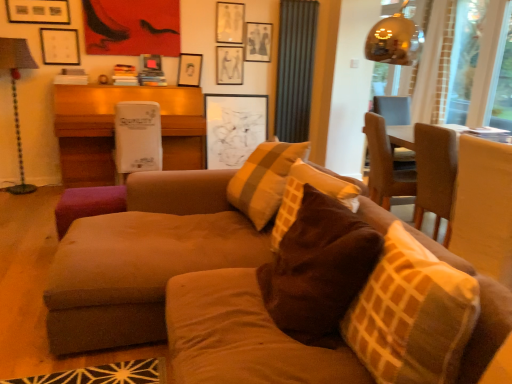
Question: Based on their positions, is suede couch at center located to the left or right of matte black picture frame at upper center, the fourth picture frame from the left?

Choices:
 (A) left
 (B) right

Answer: (B)

Question: From the image's perspective, relative to matte black picture frame at upper center, the fourth picture frame from the left, is suede couch at center above or below?

Choices:
 (A) below
 (B) above

Answer: (A)

Question: Which object is the farthest from the matte black picture frame at upper center, which is the fifth picture frame in left-to-right order?

Choices:
 (A) suede couch at center
 (B) wooden table at right, the 2th table viewed from the back
 (C) transparent glass window screen at upper right, arranged as the 1th window screen when viewed from the left
 (D) matte black picture frame at upper center, which appears as the second picture frame when viewed from the right
 (E) dark green fabric curtain at upper center

Answer: (A)

Question: Considering the real-world distances, which object is closest to the suede couch at center?

Choices:
 (A) transparent glass window screen at upper right, marked as the 2th window screen in a left-to-right arrangement
 (B) matte black picture frame at upper center, arranged as the second picture frame when viewed from the left
 (C) metallic lampshade at left
 (D) matte white picture frame at upper center, positioned as the 3th picture frame in right-to-left order
 (E) white cardboard box at center, placed as the second table when sorted from front to back

Answer: (E)